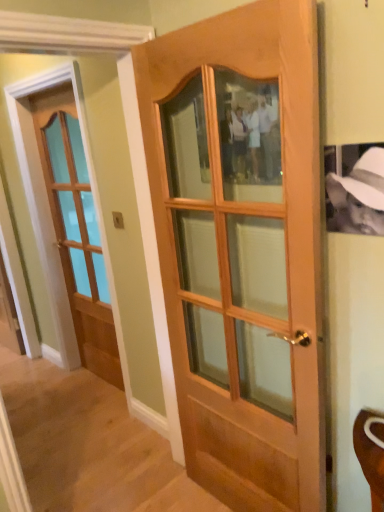
Question: Considering the positions of matte wooden door at left, the first door in the back-to-front sequence, and wooden door at center, which appears as the 2th door when viewed from the back, in the image, is matte wooden door at left, the first door in the back-to-front sequence, wider or thinner than wooden door at center, which appears as the 2th door when viewed from the back,?

Choices:
 (A) thin
 (B) wide

Answer: (A)

Question: Is matte wooden door at left, which ranks as the second door in front-to-back order, bigger or smaller than wooden door at center, acting as the first door starting from the right?

Choices:
 (A) small
 (B) big

Answer: (A)

Question: Does point (109, 330) appear closer or farther from the camera than point (208, 269)?

Choices:
 (A) farther
 (B) closer

Answer: (A)

Question: From their relative heights in the image, would you say wooden door at center, acting as the first door starting from the right, is taller or shorter than matte wooden door at left, the 1th door viewed from the left?

Choices:
 (A) tall
 (B) short

Answer: (B)

Question: Is wooden door at center, which appears as the 2th door when viewed from the back, to the left or to the right of matte wooden door at left, which ranks as the second door in front-to-back order, in the image?

Choices:
 (A) right
 (B) left

Answer: (A)

Question: Is wooden door at center, the 2th door from the left, in front of or behind matte wooden door at left, placed as the second door when sorted from right to left, in the image?

Choices:
 (A) behind
 (B) front

Answer: (B)

Question: From the image's perspective, relative to matte wooden door at left, which ranks as the second door in front-to-back order, is wooden door at center, marked as the 1th door in a front-to-back arrangement, above or below?

Choices:
 (A) below
 (B) above

Answer: (A)